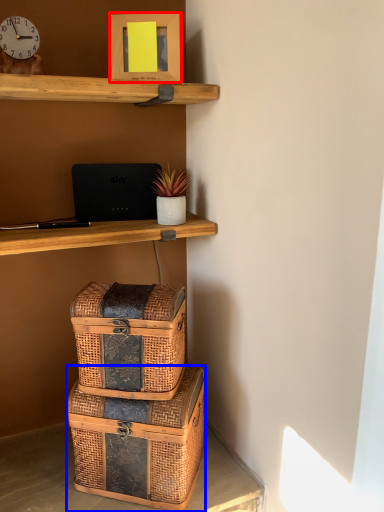
Question: Which object appears farthest to the camera in this image, picture frame (highlighted by a red box) or box (highlighted by a blue box)?

Choices:
 (A) picture frame
 (B) box

Answer: (A)